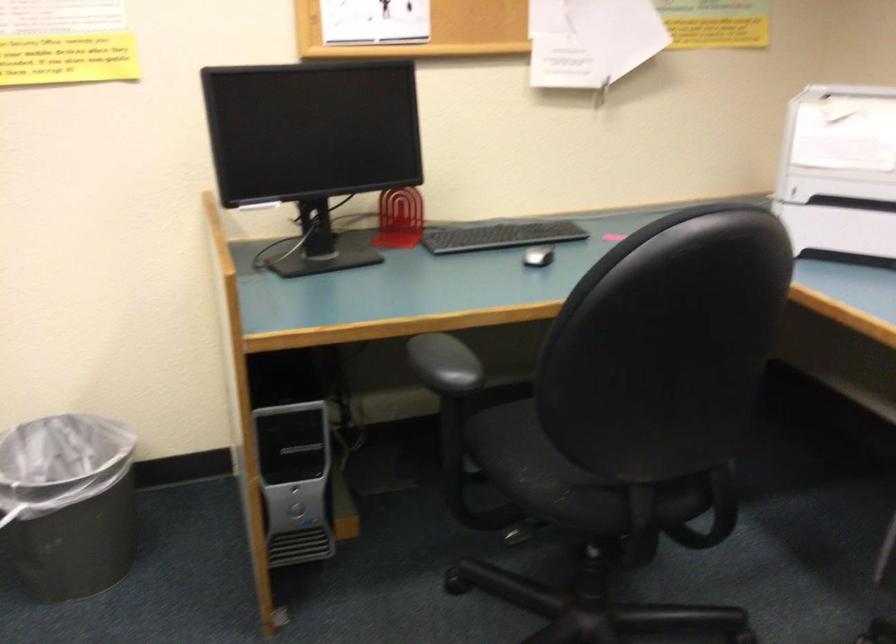
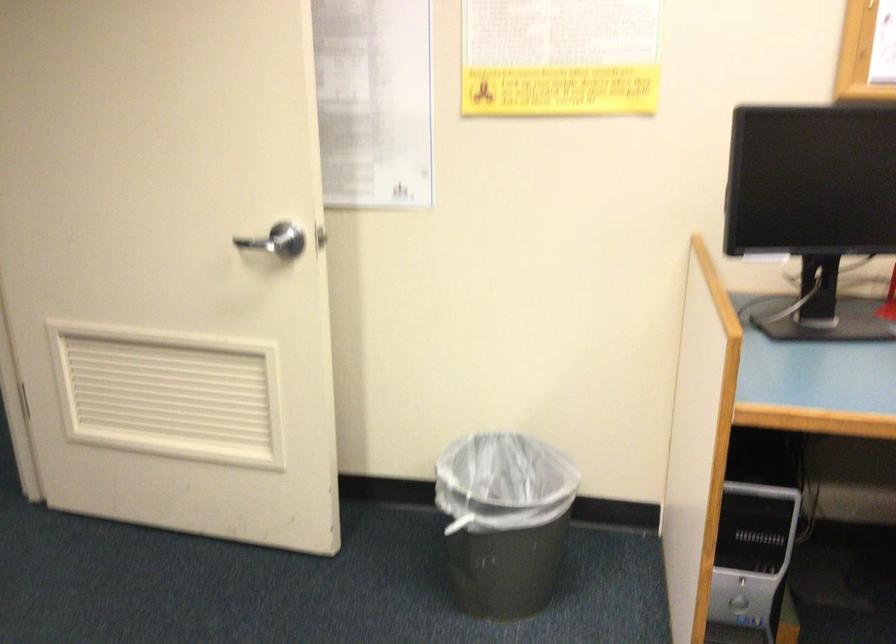
Locate, in the second image, the point that corresponds to (300,506) in the first image.

(737, 601)